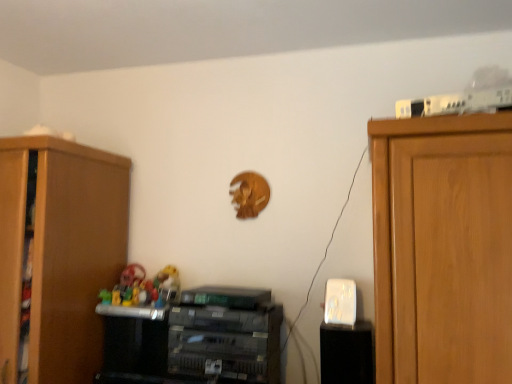
Measure the distance between point (322, 340) and camera.

The depth of point (322, 340) is 5.59 feet.

At what (x,y) coordinates should I click in order to perform the action: click on wooden cabinet at left, the first cabinetry in the left-to-right sequence. Please return your answer as a coordinate pair (x, y). This screenshot has height=384, width=512. Looking at the image, I should click on (60, 252).

Find the location of a particular element. This screenshot has height=384, width=512. black plastic speaker at lower right, the 1th cabinetry when ordered from right to left is located at coordinates (347, 353).

From a real-world perspective, is wooden cabinet at left, the first cabinetry in the left-to-right sequence, under rubber toys at center?

No, from a real-world perspective, wooden cabinet at left, the first cabinetry in the left-to-right sequence, is not under rubber toys at center.

Is point (88, 148) farther from camera compared to point (157, 284)?

That is False.

Considering the sizes of objects wooden cabinet at left, placed as the third cabinetry when sorted from right to left, and rubber toys at center in the image provided, who is wider, wooden cabinet at left, placed as the third cabinetry when sorted from right to left, or rubber toys at center?

With larger width is wooden cabinet at left, placed as the third cabinetry when sorted from right to left.

From a real-world perspective, is black plastic speaker at lower right, the 1th cabinetry when ordered from right to left, physically above wooden cabinet at left, the first cabinetry in the left-to-right sequence?

No, from a real-world perspective, black plastic speaker at lower right, the 1th cabinetry when ordered from right to left, is not above wooden cabinet at left, the first cabinetry in the left-to-right sequence.

Considering the relative positions of black plastic speaker at lower right, the 1th cabinetry when ordered from right to left, and wooden cabinet at left, the first cabinetry in the left-to-right sequence, in the image provided, is black plastic speaker at lower right, the 1th cabinetry when ordered from right to left, behind wooden cabinet at left, the first cabinetry in the left-to-right sequence,?

Yes, the depth of black plastic speaker at lower right, the 1th cabinetry when ordered from right to left, is greater than that of wooden cabinet at left, the first cabinetry in the left-to-right sequence.

From the picture: From the image's perspective, between black plastic speaker at lower right, which is counted as the third cabinetry, starting from the left, and wooden cabinet at left, placed as the third cabinetry when sorted from right to left, which one is located above?

wooden cabinet at left, placed as the third cabinetry when sorted from right to left, appears higher in the image.

Which of these two, black plastic speaker at lower right, which is counted as the third cabinetry, starting from the left, or wooden cabinet at left, placed as the third cabinetry when sorted from right to left, is smaller?

black plastic speaker at lower right, which is counted as the third cabinetry, starting from the left, is smaller.

Considering the sizes of black plastic speaker at lower right, which is counted as the third cabinetry, starting from the left, and rubber toys at center in the image, is black plastic speaker at lower right, which is counted as the third cabinetry, starting from the left, bigger or smaller than rubber toys at center?

black plastic speaker at lower right, which is counted as the third cabinetry, starting from the left, is smaller than rubber toys at center.

Is black plastic speaker at lower right, which is counted as the third cabinetry, starting from the left, next to rubber toys at center?

No, black plastic speaker at lower right, which is counted as the third cabinetry, starting from the left, is not in contact with rubber toys at center.

From the image's perspective, is black plastic speaker at lower right, the 1th cabinetry when ordered from right to left, on rubber toys at center?

No, from the image's perspective, black plastic speaker at lower right, the 1th cabinetry when ordered from right to left, is not over rubber toys at center.

Find the location of a particular element. toy above the black plastic speaker at lower right, which is counted as the third cabinetry, starting from the left (from a real-world perspective) is located at coordinates (144, 287).

From a real-world perspective, between black plastic speaker at lower right, which is counted as the third cabinetry, starting from the left, and metallic gray printer at center, arranged as the 2th cabinetry when viewed from the right, who is vertically lower?

black plastic speaker at lower right, which is counted as the third cabinetry, starting from the left, is physically lower.

From the image's perspective, relative to metallic gray printer at center, the 2th cabinetry in the left-to-right sequence, is black plastic speaker at lower right, which is counted as the third cabinetry, starting from the left, above or below?

black plastic speaker at lower right, which is counted as the third cabinetry, starting from the left, is situated lower than metallic gray printer at center, the 2th cabinetry in the left-to-right sequence, in the image.

Considering the relative sizes of black plastic speaker at lower right, the 1th cabinetry when ordered from right to left, and metallic gray printer at center, arranged as the 2th cabinetry when viewed from the right, in the image provided, is black plastic speaker at lower right, the 1th cabinetry when ordered from right to left, shorter than metallic gray printer at center, arranged as the 2th cabinetry when viewed from the right,?

Indeed, black plastic speaker at lower right, the 1th cabinetry when ordered from right to left, has a lesser height compared to metallic gray printer at center, arranged as the 2th cabinetry when viewed from the right.

Can you tell me how much black plastic speaker at lower right, which is counted as the third cabinetry, starting from the left, and metallic gray printer at center, the 2th cabinetry in the left-to-right sequence, differ in facing direction?

The angular difference between black plastic speaker at lower right, which is counted as the third cabinetry, starting from the left, and metallic gray printer at center, the 2th cabinetry in the left-to-right sequence, is 0.000667 degrees.

Does rubber toys at center come in front of wooden cabinet at left, placed as the third cabinetry when sorted from right to left?

No, it is not.

From the image's perspective, relative to wooden cabinet at left, placed as the third cabinetry when sorted from right to left, is rubber toys at center above or below?

Based on their image positions, rubber toys at center is located beneath wooden cabinet at left, placed as the third cabinetry when sorted from right to left.

Consider the image. Does rubber toys at center turn towards wooden cabinet at left, the first cabinetry in the left-to-right sequence?

No, rubber toys at center is not oriented towards wooden cabinet at left, the first cabinetry in the left-to-right sequence.

How far apart are rubber toys at center and wooden cabinet at left, placed as the third cabinetry when sorted from right to left?

rubber toys at center is 12.33 inches away from wooden cabinet at left, placed as the third cabinetry when sorted from right to left.

From a real-world perspective, which cabinetry is the 1st one underneath the rubber toys at center? Please provide its 2D coordinates.

[(226, 335)]

From the image's perspective, which one is positioned higher, rubber toys at center or metallic gray printer at center, arranged as the 2th cabinetry when viewed from the right?

rubber toys at center is shown above in the image.

Does rubber toys at center come in front of metallic gray printer at center, arranged as the 2th cabinetry when viewed from the right?

No, rubber toys at center is behind metallic gray printer at center, arranged as the 2th cabinetry when viewed from the right.

Does metallic gray printer at center, the 2th cabinetry in the left-to-right sequence, touch black plastic speaker at lower right, the 1th cabinetry when ordered from right to left?

No, metallic gray printer at center, the 2th cabinetry in the left-to-right sequence, is not next to black plastic speaker at lower right, the 1th cabinetry when ordered from right to left.

Between point (243, 333) and point (361, 344), which one is positioned behind?

Point (361, 344)

From the picture: Does metallic gray printer at center, the 2th cabinetry in the left-to-right sequence, have a larger size compared to black plastic speaker at lower right, which is counted as the third cabinetry, starting from the left?

Indeed, metallic gray printer at center, the 2th cabinetry in the left-to-right sequence, has a larger size compared to black plastic speaker at lower right, which is counted as the third cabinetry, starting from the left.

From a real-world perspective, is metallic gray printer at center, the 2th cabinetry in the left-to-right sequence, on black plastic speaker at lower right, which is counted as the third cabinetry, starting from the left?

Yes, from a real-world perspective, metallic gray printer at center, the 2th cabinetry in the left-to-right sequence, is on top of black plastic speaker at lower right, which is counted as the third cabinetry, starting from the left.

This screenshot has width=512, height=384. Identify the location of cabinetry above the rubber toys at center (from the image's perspective). (60, 252).

Locate an element on the screen. The height and width of the screenshot is (384, 512). cabinetry that appears in front of the black plastic speaker at lower right, which is counted as the third cabinetry, starting from the left is located at coordinates (60, 252).

Which object lies further to the anchor point black plastic speaker at lower right, which is counted as the third cabinetry, starting from the left, wooden cabinet at left, the first cabinetry in the left-to-right sequence, or metallic gray printer at center, arranged as the 2th cabinetry when viewed from the right?

wooden cabinet at left, the first cabinetry in the left-to-right sequence, is positioned further to the anchor black plastic speaker at lower right, which is counted as the third cabinetry, starting from the left.

Looking at the image, which one is located closer to wooden cabinet at left, placed as the third cabinetry when sorted from right to left, rubber toys at center or black plastic speaker at lower right, which is counted as the third cabinetry, starting from the left?

rubber toys at center is positioned closer to the anchor wooden cabinet at left, placed as the third cabinetry when sorted from right to left.

Which object lies nearer to the anchor point black plastic speaker at lower right, which is counted as the third cabinetry, starting from the left, wooden cabinet at left, placed as the third cabinetry when sorted from right to left, or rubber toys at center?

rubber toys at center is closer to black plastic speaker at lower right, which is counted as the third cabinetry, starting from the left.

Which object lies nearer to the anchor point metallic gray printer at center, the 2th cabinetry in the left-to-right sequence, wooden cabinet at left, placed as the third cabinetry when sorted from right to left, or rubber toys at center?

Among the two, rubber toys at center is located nearer to metallic gray printer at center, the 2th cabinetry in the left-to-right sequence.

From the image, which object appears to be farther from metallic gray printer at center, the 2th cabinetry in the left-to-right sequence, black plastic speaker at lower right, which is counted as the third cabinetry, starting from the left, or wooden cabinet at left, the first cabinetry in the left-to-right sequence?

Based on the image, wooden cabinet at left, the first cabinetry in the left-to-right sequence, appears to be further to metallic gray printer at center, the 2th cabinetry in the left-to-right sequence.

Estimate the real-world distances between objects in this image. Which object is closer to black plastic speaker at lower right, which is counted as the third cabinetry, starting from the left, rubber toys at center or metallic gray printer at center, arranged as the 2th cabinetry when viewed from the right?

metallic gray printer at center, arranged as the 2th cabinetry when viewed from the right, is closer to black plastic speaker at lower right, which is counted as the third cabinetry, starting from the left.

Based on their spatial positions, is wooden cabinet at left, placed as the third cabinetry when sorted from right to left, or black plastic speaker at lower right, which is counted as the third cabinetry, starting from the left, closer to rubber toys at center?

wooden cabinet at left, placed as the third cabinetry when sorted from right to left.

Based on their spatial positions, is black plastic speaker at lower right, the 1th cabinetry when ordered from right to left, or rubber toys at center closer to metallic gray printer at center, arranged as the 2th cabinetry when viewed from the right?

rubber toys at center lies closer to metallic gray printer at center, arranged as the 2th cabinetry when viewed from the right, than the other object.

Where is `toy between wooden cabinet at left, the first cabinetry in the left-to-right sequence, and black plastic speaker at lower right, the 1th cabinetry when ordered from right to left`? toy between wooden cabinet at left, the first cabinetry in the left-to-right sequence, and black plastic speaker at lower right, the 1th cabinetry when ordered from right to left is located at coordinates (144, 287).

Locate an element on the screen. The height and width of the screenshot is (384, 512). cabinetry between rubber toys at center and black plastic speaker at lower right, the 1th cabinetry when ordered from right to left is located at coordinates (226, 335).

Find the location of a particular element. The height and width of the screenshot is (384, 512). toy located between wooden cabinet at left, placed as the third cabinetry when sorted from right to left, and metallic gray printer at center, the 2th cabinetry in the left-to-right sequence, in the left-right direction is located at coordinates (144, 287).

You are a GUI agent. You are given a task and a screenshot of the screen. Output one action in this format:
    pyautogui.click(x=<x>, y=<y>)
    Task: Click on the cabinetry situated between wooden cabinet at left, placed as the third cabinetry when sorted from right to left, and black plastic speaker at lower right, the 1th cabinetry when ordered from right to left, from left to right
    The height and width of the screenshot is (384, 512).
    Given the screenshot: What is the action you would take?
    pyautogui.click(x=226, y=335)